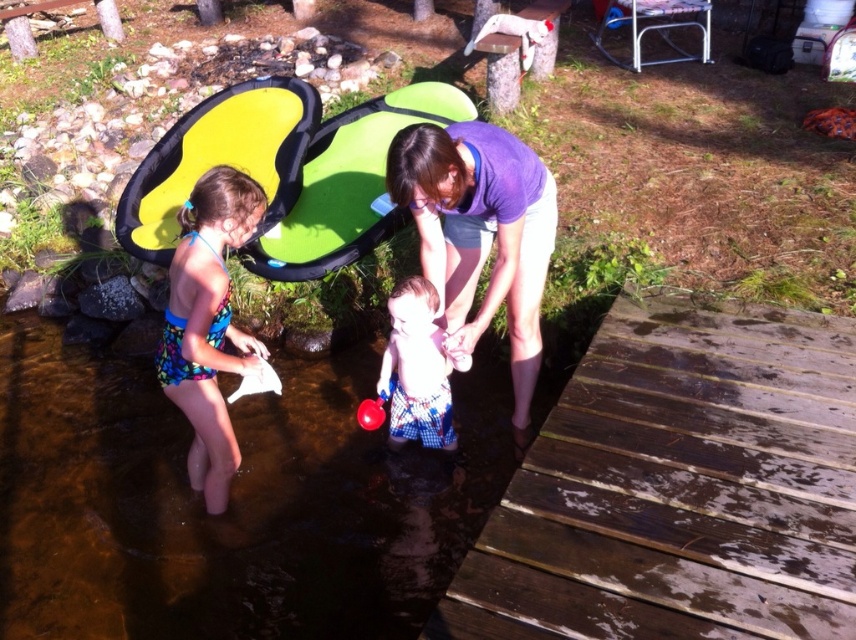
You are planning to cross the shallow water to reach the dock. You see a green inflatable at upper center and plaid shorts at center. Which object can you step on to avoid getting your shoes muddy?

The green inflatable at upper center has a larger width than the plaid shorts at center, so stepping on the green inflatable at upper center would provide a wider and more stable surface to avoid getting your shoes muddy.

You are standing at point (471,177) and want to walk to the wooden dock. Is the point (200,410) between you and the dock?

Point (471,177) is in front of point (200,410), so the point (200,410) is behind you and not between you and the dock.